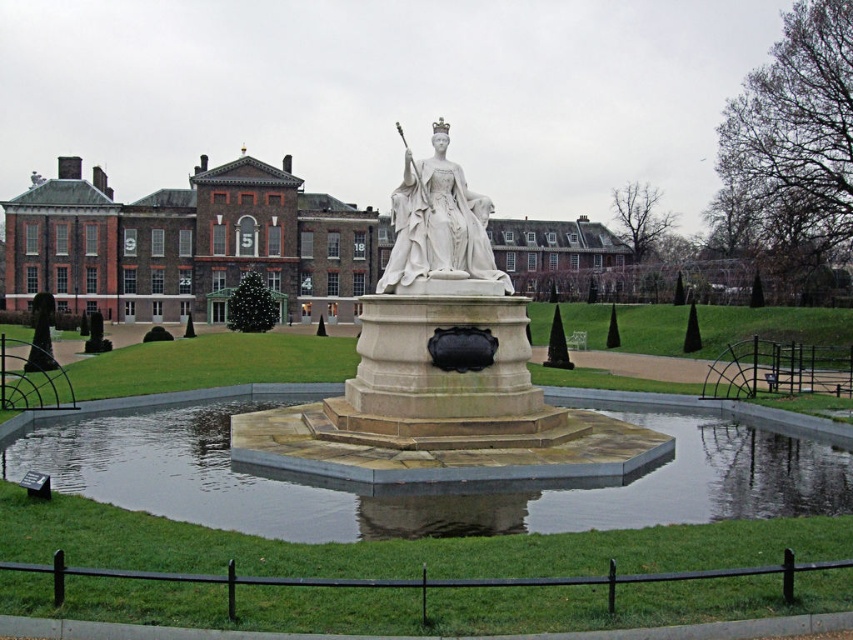
Locate an element on the screen. The height and width of the screenshot is (640, 853). white stone fountain at center is located at coordinates (422, 502).

What do you see at coordinates (422, 502) in the screenshot?
I see `white stone fountain at center` at bounding box center [422, 502].

Between point (323, 564) and point (389, 268), which one is positioned behind?

Point (389, 268)

The image size is (853, 640). I want to click on white stone fountain at center, so click(422, 502).

Image resolution: width=853 pixels, height=640 pixels. Describe the element at coordinates (422, 502) in the screenshot. I see `white stone fountain at center` at that location.

The height and width of the screenshot is (640, 853). What are the coordinates of `white stone fountain at center` in the screenshot? It's located at (422, 502).

The height and width of the screenshot is (640, 853). Find the location of `white stone fountain at center`. white stone fountain at center is located at coordinates (422, 502).

Which is below, white marble fountain at center or white marble statue at center?

white marble fountain at center

Locate an element on the screen. Image resolution: width=853 pixels, height=640 pixels. white marble fountain at center is located at coordinates (442, 369).

Which is behind, point (541, 445) or point (407, 285)?

Positioned behind is point (407, 285).

Locate an element on the screen. This screenshot has width=853, height=640. white marble fountain at center is located at coordinates (442, 369).